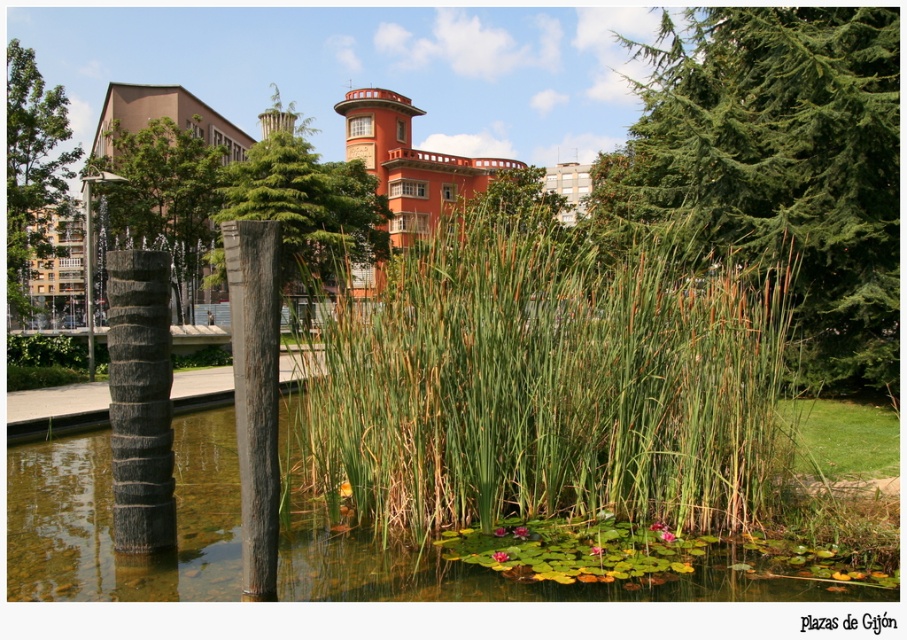
Question: Among these points, which one is farthest from the camera?

Choices:
 (A) (116, 184)
 (B) (378, 232)

Answer: (B)

Question: Does dark gray textured pole at center appear over smooth gray tree at center?

Choices:
 (A) yes
 (B) no

Answer: (B)

Question: Which of the following is the farthest from the observer?

Choices:
 (A) green leafy tree at center
 (B) green leafy tree at upper left
 (C) green needle-like leaves at upper right

Answer: (B)

Question: Which point is farther to the camera?

Choices:
 (A) click(135, 168)
 (B) click(818, 129)

Answer: (A)

Question: Can you confirm if dark gray textured column at left is wider than green leafy tree at upper left?

Choices:
 (A) yes
 (B) no

Answer: (B)

Question: Can you confirm if dark gray textured column at left is positioned to the right of dark gray textured pole at center?

Choices:
 (A) no
 (B) yes

Answer: (A)